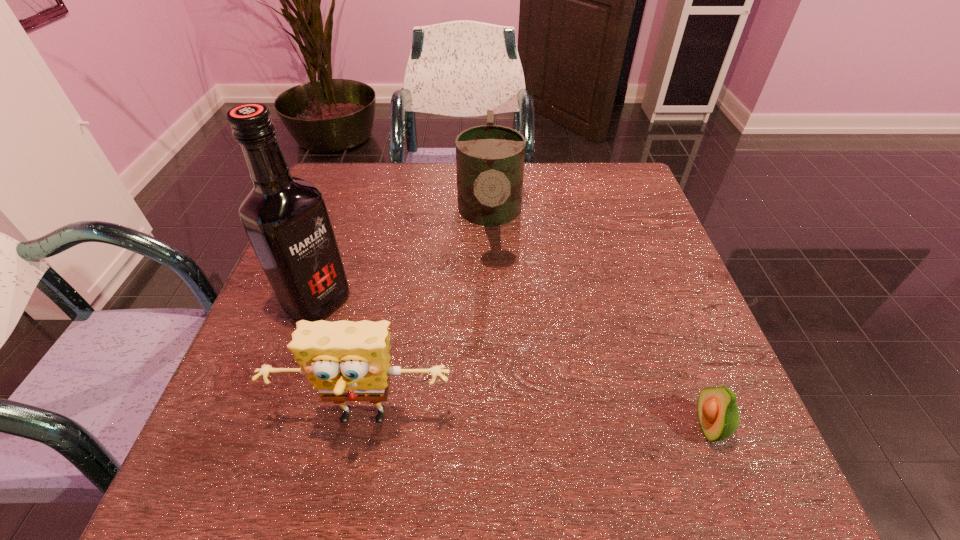
Locate an element on the screen. The height and width of the screenshot is (540, 960). vacant space located on the front-facing side of the second farthest object is located at coordinates (429, 366).

Identify the location of free space located on the front-facing side of the second farthest object. The height and width of the screenshot is (540, 960). (388, 343).

Identify the location of free spot located 0.160m with the spout on the watering can. Image resolution: width=960 pixels, height=540 pixels. point(492,330).

The image size is (960, 540). I want to click on free space located with the spout on the watering can, so click(492, 290).

Image resolution: width=960 pixels, height=540 pixels. Find the location of `blank space located 0.370m with the spout on the watering can`. blank space located 0.370m with the spout on the watering can is located at coordinates (493, 429).

Locate an element on the screen. The width and height of the screenshot is (960, 540). object located at the far edge is located at coordinates (490, 158).

The height and width of the screenshot is (540, 960). What are the coordinates of `sponge at the near edge` in the screenshot? It's located at (346, 361).

Find the location of a particular element. avocado that is at the near edge is located at coordinates (718, 413).

You are a GUI agent. You are given a task and a screenshot of the screen. Output one action in this format:
    pyautogui.click(x=<x>, y=<y>)
    Task: Click on the sponge that is at the left edge
    
    Given the screenshot: What is the action you would take?
    pyautogui.click(x=346, y=361)

Where is `liquor that is at the left edge`? Image resolution: width=960 pixels, height=540 pixels. liquor that is at the left edge is located at coordinates (286, 219).